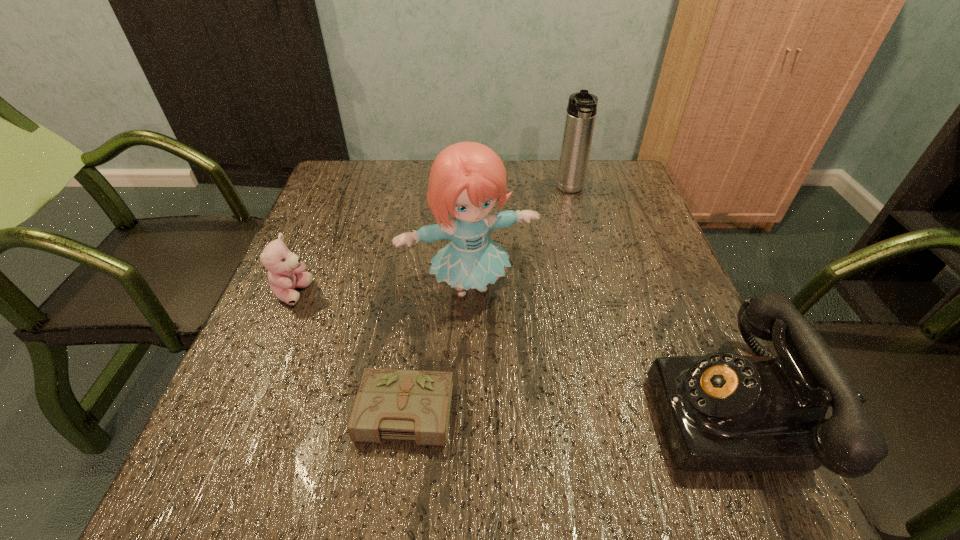
Where is `empty space between the diary and the second shortest object`? Image resolution: width=960 pixels, height=540 pixels. empty space between the diary and the second shortest object is located at coordinates (344, 352).

Where is `free space between the diary and the second shortest object`? Image resolution: width=960 pixels, height=540 pixels. free space between the diary and the second shortest object is located at coordinates (344, 352).

The width and height of the screenshot is (960, 540). I want to click on vacant point located between the tallest object and the farthest object, so click(520, 239).

I want to click on object identified as the fourth closest to the doll, so click(581, 111).

Locate which object is the second closest to the third tallest object. Please provide its 2D coordinates. Your answer should be formatted as a tuple, i.e. [(x, y)], where the tuple contains the x and y coordinates of a point satisfying the conditions above.

[(415, 405)]